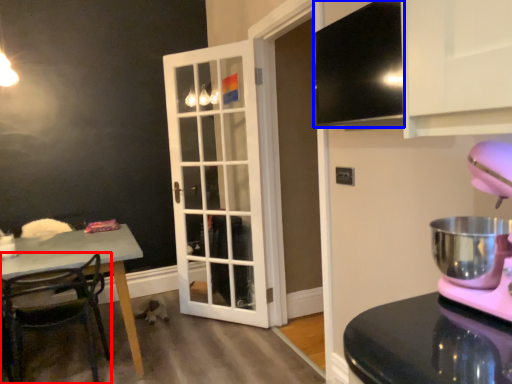
Question: Which object is closer to the camera taking this photo, chair (highlighted by a red box) or exhaust hood (highlighted by a blue box)?

Choices:
 (A) chair
 (B) exhaust hood

Answer: (B)